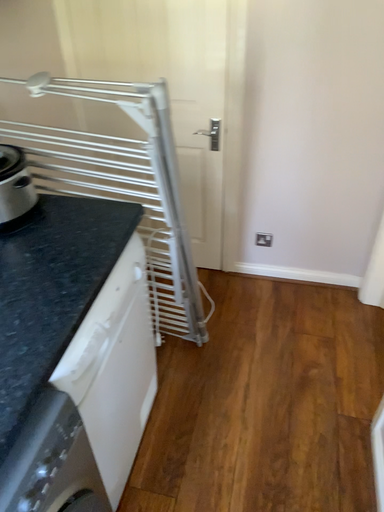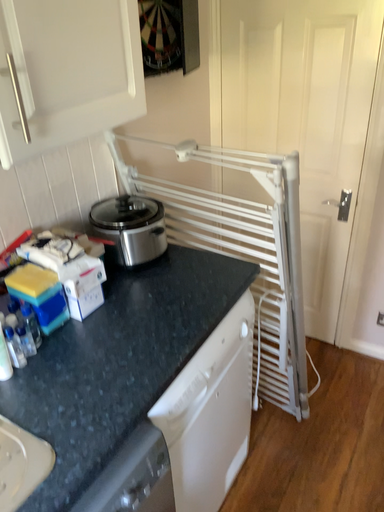
Question: How did the camera likely rotate when shooting the video?

Choices:
 (A) rotated left
 (B) rotated right

Answer: (A)